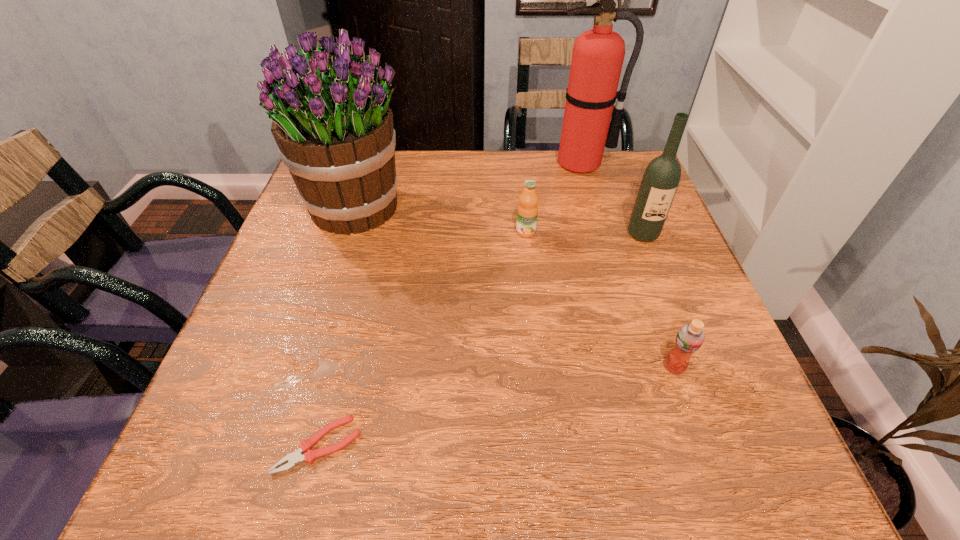
Select which object is the fifth closest to the fire extinguisher. Please provide its 2D coordinates. Your answer should be formatted as a tuple, i.e. [(x, y)], where the tuple contains the x and y coordinates of a point satisfying the conditions above.

[(309, 456)]

This screenshot has height=540, width=960. Find the location of `object that can be found as the third closest to the fifth farthest object`. object that can be found as the third closest to the fifth farthest object is located at coordinates (309, 456).

Where is `free space that satisfies the following two spatial constraints: 1. on the label of the right orange juice; 2. on the left side of the left orange juice`? The height and width of the screenshot is (540, 960). free space that satisfies the following two spatial constraints: 1. on the label of the right orange juice; 2. on the left side of the left orange juice is located at coordinates (540, 367).